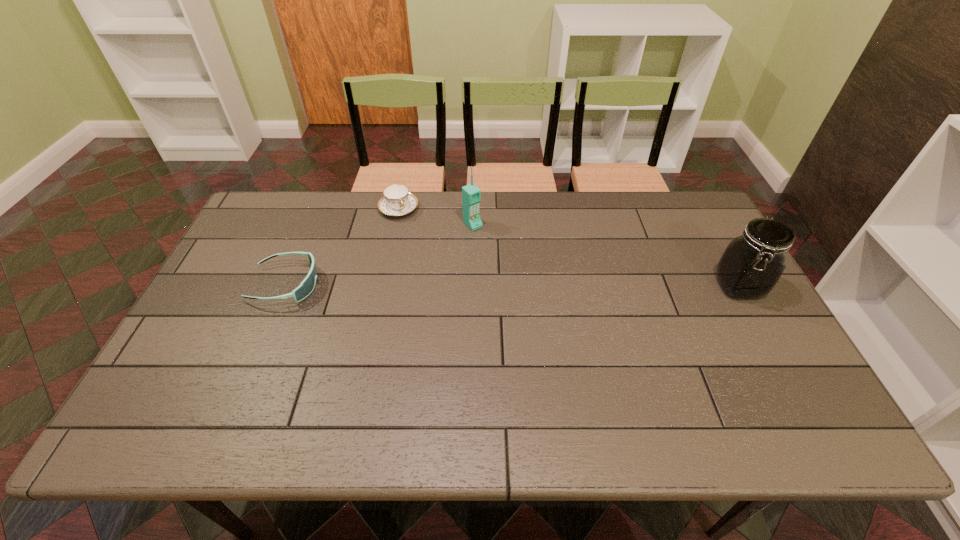
Where is `vacant space on the desktop that is between the leftmost object and the rightmost object and is positioned on the keypad of the third object from left to right`? vacant space on the desktop that is between the leftmost object and the rightmost object and is positioned on the keypad of the third object from left to right is located at coordinates (535, 286).

The height and width of the screenshot is (540, 960). Identify the location of vacant space on the desktop that is between the leftmost object and the jar and is positioned on the side with the handle of the teacup. (446, 285).